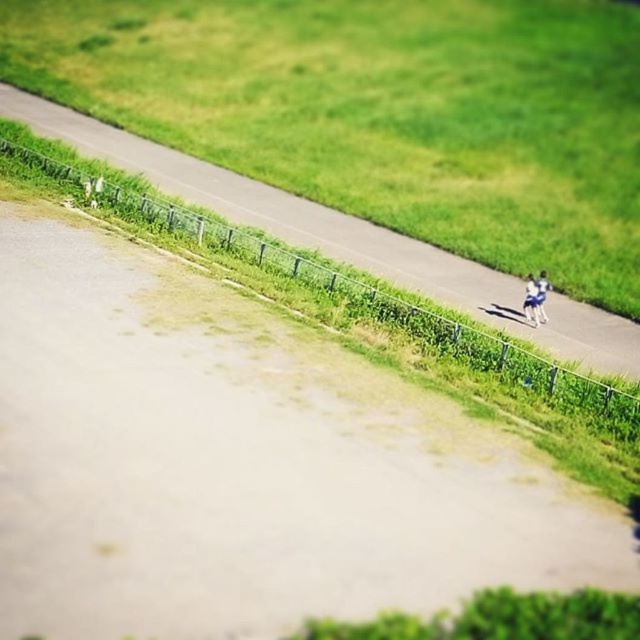
You are standing at the point labeled as point (570, 353) in the image. The camera is positioned at a higher elevation. If you want to walk directly towards the camera, which direction should you head? Please provide your answer in terms of compass directions like north, south, east, or west.

To determine the direction to walk towards the camera, you would need to consider the camera position relative to your current location. Since the camera is positioned at a higher elevation and the point is labeled as (570, 353), which is likely in the lower part of the image, you should head north. However, without specific coordinate mappings to compass directions, the most accurate answer based on typical image coordinates is that you should move upwards in the image, which corresponds to a northerly,

Looking at this image, you are standing at the point closer to the camera between the two points, point (26, 93) and point (544, 292). If you want to walk towards the point further away, which direction should you move relative to the path?

You should move towards the path because point (26, 93) is closer to the camera and the path is in the foreground, so moving towards the path would take you away from the camera and towards point (544, 292).